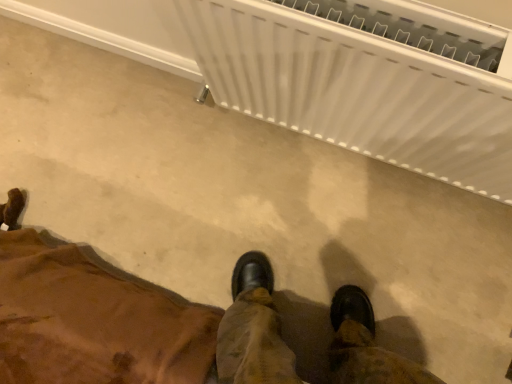
Describe the element at coordinates (357, 87) in the screenshot. I see `white matte radiator at upper center` at that location.

At what (x,y) coordinates should I click in order to perform the action: click on white matte radiator at upper center. Please return your answer as a coordinate pair (x, y). The image size is (512, 384). Looking at the image, I should click on 357,87.

This screenshot has height=384, width=512. In order to click on white matte radiator at upper center in this screenshot , I will do `click(357, 87)`.